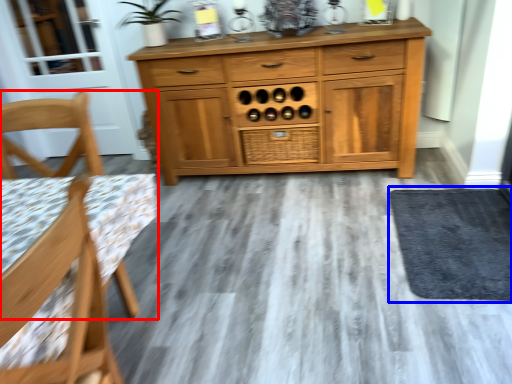
Question: Which object appears farthest to the camera in this image, chair (highlighted by a red box) or door (highlighted by a blue box)?

Choices:
 (A) chair
 (B) door

Answer: (B)